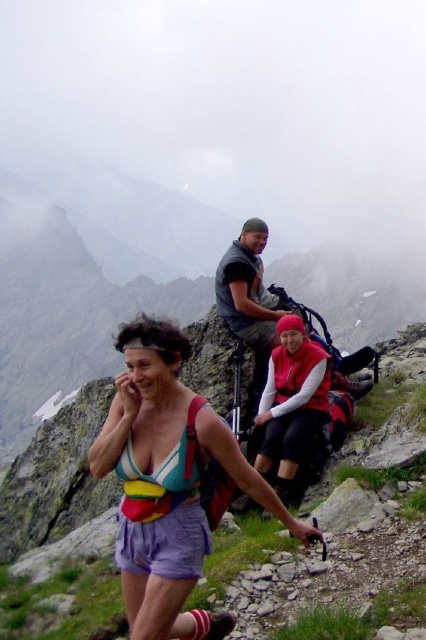
Does rainbow fabric fanny pack at center have a smaller size compared to multicolored fabric bikini top at center?

Incorrect, rainbow fabric fanny pack at center is not smaller in size than multicolored fabric bikini top at center.

Who is more distant from viewer, (241, 465) or (163, 481)?

The point (163, 481) is more distant.

Identify the location of rainbow fabric fanny pack at center. (169, 483).

How much distance is there between rainbow fabric fanny pack at center and red fleece vest at center?

5.58 meters

Measure the distance between rainbow fabric fanny pack at center and red fleece vest at center.

rainbow fabric fanny pack at center and red fleece vest at center are 5.58 meters apart.

What do you see at coordinates (169, 483) in the screenshot? I see `rainbow fabric fanny pack at center` at bounding box center [169, 483].

This screenshot has width=426, height=640. Identify the location of rainbow fabric fanny pack at center. (169, 483).

Who is shorter, red fleece vest at center or multicolored fabric bikini top at center?

multicolored fabric bikini top at center

What do you see at coordinates (291, 403) in the screenshot? The image size is (426, 640). I see `red fleece vest at center` at bounding box center [291, 403].

Is point (311, 419) less distant than point (173, 481)?

No, (311, 419) is behind (173, 481).

Locate an element on the screen. This screenshot has height=640, width=426. red fleece vest at center is located at coordinates (291, 403).